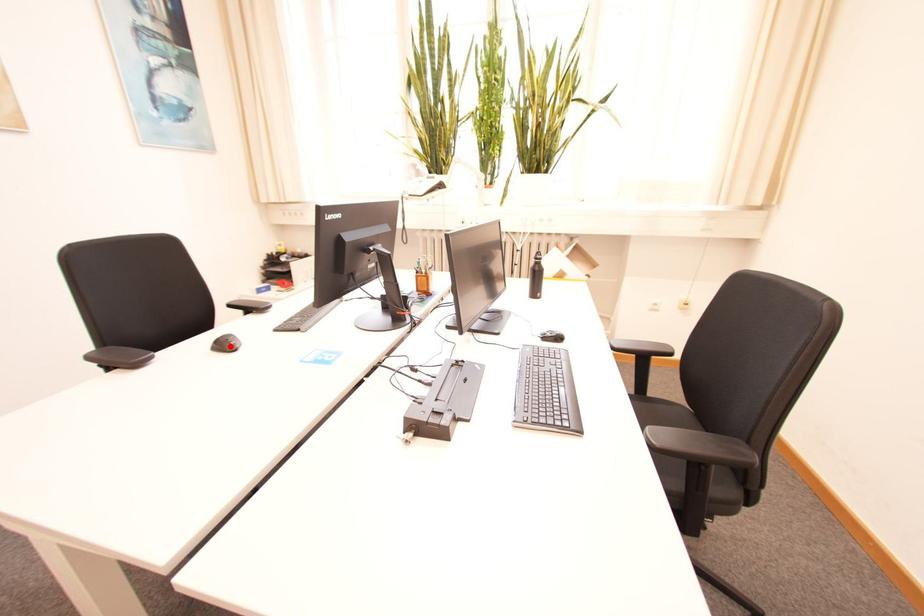
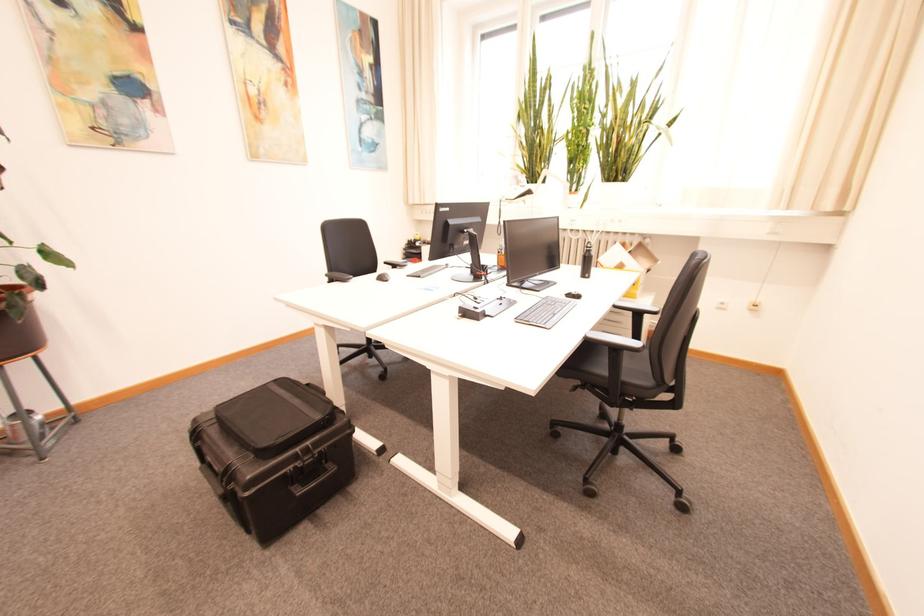
Locate, in the second image, the point that corresponds to the highlighted location in the first image.

(388, 280)